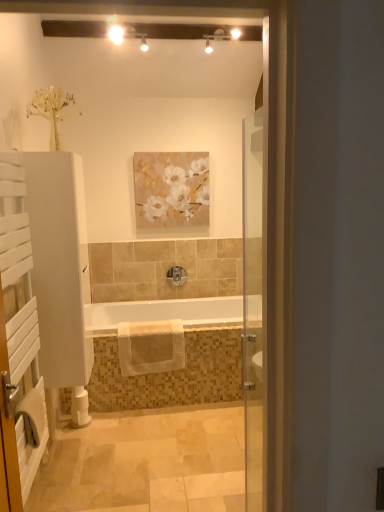
The image size is (384, 512). Describe the element at coordinates (163, 312) in the screenshot. I see `white glossy bathtub at center` at that location.

Find the location of a particular element. The width and height of the screenshot is (384, 512). polished chrome faucet at center is located at coordinates (176, 276).

Find the location of `white soft towel at lower left, arranged as the 2th bath towel when viewed from the right`. white soft towel at lower left, arranged as the 2th bath towel when viewed from the right is located at coordinates (32, 415).

At what (x,y) coordinates should I click in order to perform the action: click on white glossy bathtub at center. Please return your answer as a coordinate pair (x, y). Looking at the image, I should click on (163, 312).

In terms of size, does beige textured towel at center, which ranks as the 1th bath towel in right-to-left order, appear bigger or smaller than matte floral painting at upper center?

In the image, beige textured towel at center, which ranks as the 1th bath towel in right-to-left order, appears to be larger than matte floral painting at upper center.

Is beige textured towel at center, the 2th bath towel from the left, looking in the opposite direction of matte floral painting at upper center?

No, beige textured towel at center, the 2th bath towel from the left, is not facing away from matte floral painting at upper center.

From the image's perspective, relative to matte floral painting at upper center, is beige textured towel at center, the 2th bath towel from the left, above or below?

From the image's perspective, beige textured towel at center, the 2th bath towel from the left, appears below matte floral painting at upper center.

From the picture: Can you confirm if beige textured towel at center, which ranks as the 1th bath towel in right-to-left order, is thinner than matte floral painting at upper center?

In fact, beige textured towel at center, which ranks as the 1th bath towel in right-to-left order, might be wider than matte floral painting at upper center.

Does white soft towel at lower left, the 2th bath towel from the back, appear on the right side of beige textured towel at center, which is the 2th bath towel in front-to-back order?

In fact, white soft towel at lower left, the 2th bath towel from the back, is to the left of beige textured towel at center, which is the 2th bath towel in front-to-back order.

Would you consider white soft towel at lower left, which is the first bath towel from left to right, to be distant from beige textured towel at center, which ranks as the 1th bath towel in right-to-left order?

Yes.

Which object is thinner, white soft towel at lower left, the first bath towel viewed from the front, or beige textured towel at center, which ranks as the 1th bath towel in right-to-left order?

white soft towel at lower left, the first bath towel viewed from the front, is thinner.

Would you say matte floral painting at upper center is inside or outside white soft towel at lower left, which is the first bath towel from left to right?

matte floral painting at upper center exists outside the volume of white soft towel at lower left, which is the first bath towel from left to right.

Measure the distance between matte floral painting at upper center and white soft towel at lower left, the 2th bath towel from the back.

matte floral painting at upper center is 7.39 feet away from white soft towel at lower left, the 2th bath towel from the back.

Is matte floral painting at upper center at the right side of white soft towel at lower left, which is the first bath towel from left to right?

Indeed, matte floral painting at upper center is positioned on the right side of white soft towel at lower left, which is the first bath towel from left to right.

Who is shorter, matte floral painting at upper center or white soft towel at lower left, the first bath towel viewed from the front?

With less height is white soft towel at lower left, the first bath towel viewed from the front.

Is white glossy bathtub at center not near polished chrome faucet at center?

No, there isn't a large distance between white glossy bathtub at center and polished chrome faucet at center.

Considering the positions of objects white glossy bathtub at center and polished chrome faucet at center in the image provided, who is more to the left, white glossy bathtub at center or polished chrome faucet at center?

white glossy bathtub at center is more to the left.

Is white glossy bathtub at center positioned in front of polished chrome faucet at center?

Yes, it is.

From the image's perspective, which is above, white glossy bathtub at center or polished chrome faucet at center?

polished chrome faucet at center is shown above in the image.

Which is closer to the camera, (121,353) or (31,403)?

Point (121,353) is positioned farther from the camera compared to point (31,403).

Which of these two, beige textured towel at center, the 2th bath towel from the left, or white soft towel at lower left, which is the first bath towel from left to right, stands shorter?

With less height is white soft towel at lower left, which is the first bath towel from left to right.

Consider the image. Considering the positions of objects beige textured towel at center, which ranks as the 1th bath towel in right-to-left order, and white soft towel at lower left, the 2th bath towel from the back, in the image provided, who is more to the left, beige textured towel at center, which ranks as the 1th bath towel in right-to-left order, or white soft towel at lower left, the 2th bath towel from the back,?

white soft towel at lower left, the 2th bath towel from the back.

Is white wooden towel rack at left outside of beige textured towel at center, which is the 2th bath towel in front-to-back order?

Yes, white wooden towel rack at left is not within beige textured towel at center, which is the 2th bath towel in front-to-back order.

Is white wooden towel rack at left positioned with its back to beige textured towel at center, the 2th bath towel from the left?

That's not correct — white wooden towel rack at left is not looking away from beige textured towel at center, the 2th bath towel from the left.

This screenshot has width=384, height=512. In order to click on screen door lying in front of the beige textured towel at center, the 2th bath towel from the left in this screenshot , I will do `click(18, 340)`.

Is white wooden towel rack at left next to beige textured towel at center, which is the 2th bath towel in front-to-back order, and touching it?

No, white wooden towel rack at left is not touching beige textured towel at center, which is the 2th bath towel in front-to-back order.

Is white soft towel at lower left, the first bath towel viewed from the front, looking in the opposite direction of matte floral painting at upper center?

white soft towel at lower left, the first bath towel viewed from the front, does not have its back to matte floral painting at upper center.

Choose the correct answer: Is white soft towel at lower left, the 2th bath towel from the back, inside matte floral painting at upper center or outside it?

white soft towel at lower left, the 2th bath towel from the back, cannot be found inside matte floral painting at upper center.

In terms of height, does white soft towel at lower left, the 2th bath towel from the back, look taller or shorter compared to matte floral painting at upper center?

Clearly, white soft towel at lower left, the 2th bath towel from the back, is shorter compared to matte floral painting at upper center.

Where is `picture frame lying behind the white soft towel at lower left, arranged as the 2th bath towel when viewed from the right`? This screenshot has height=512, width=384. picture frame lying behind the white soft towel at lower left, arranged as the 2th bath towel when viewed from the right is located at coordinates (171, 189).

Identify the location of the 1st bath towel below the matte floral painting at upper center (from the image's perspective). The width and height of the screenshot is (384, 512). (151, 347).

Image resolution: width=384 pixels, height=512 pixels. In order to click on bath towel on the left of beige textured towel at center, the 2th bath towel from the left in this screenshot , I will do `click(32, 415)`.

Considering their positions, is white wooden towel rack at left positioned closer to beige textured towel at center, which ranks as the 1th bath towel in right-to-left order, than white soft towel at lower left, arranged as the 2th bath towel when viewed from the right?

white soft towel at lower left, arranged as the 2th bath towel when viewed from the right, is closer to beige textured towel at center, which ranks as the 1th bath towel in right-to-left order.

Considering their positions, is polished chrome faucet at center positioned closer to white glossy bathtub at center than matte floral painting at upper center?

polished chrome faucet at center.

From the image, which object appears to be nearer to polished chrome faucet at center, beige textured towel at center, which ranks as the 1th bath towel in right-to-left order, or white soft towel at lower left, arranged as the 2th bath towel when viewed from the right?

beige textured towel at center, which ranks as the 1th bath towel in right-to-left order.

When comparing their distances from white wooden towel rack at left, does polished chrome faucet at center or matte floral painting at upper center seem closer?

Among the two, matte floral painting at upper center is located nearer to white wooden towel rack at left.

Based on their spatial positions, is matte floral painting at upper center or polished chrome faucet at center further from beige textured towel at center, which ranks as the 1th bath towel in right-to-left order?

matte floral painting at upper center lies further to beige textured towel at center, which ranks as the 1th bath towel in right-to-left order, than the other object.

Based on their spatial positions, is polished chrome faucet at center or white soft towel at lower left, the first bath towel viewed from the front, further from beige textured towel at center, which is counted as the 1th bath towel, starting from the back?

Among the two, white soft towel at lower left, the first bath towel viewed from the front, is located further to beige textured towel at center, which is counted as the 1th bath towel, starting from the back.

When comparing their distances from white soft towel at lower left, the first bath towel viewed from the front, does polished chrome faucet at center or white wooden towel rack at left seem closer?

white wooden towel rack at left.

Looking at the image, which one is located closer to polished chrome faucet at center, white soft towel at lower left, arranged as the 2th bath towel when viewed from the right, or white wooden towel rack at left?

white soft towel at lower left, arranged as the 2th bath towel when viewed from the right, is closer to polished chrome faucet at center.

This screenshot has height=512, width=384. Identify the location of bathtub between white soft towel at lower left, the 2th bath towel from the back, and matte floral painting at upper center, along the z-axis. (163, 312).

This screenshot has width=384, height=512. Find the location of `bath towel positioned between white wooden towel rack at left and beige textured towel at center, the 2th bath towel from the left, from near to far`. bath towel positioned between white wooden towel rack at left and beige textured towel at center, the 2th bath towel from the left, from near to far is located at coordinates (32, 415).

Identify the location of bathtub located between beige textured towel at center, which is the 2th bath towel in front-to-back order, and polished chrome faucet at center in the depth direction. This screenshot has width=384, height=512. (163, 312).

This screenshot has height=512, width=384. I want to click on bathtub located between white soft towel at lower left, the 2th bath towel from the back, and polished chrome faucet at center in the depth direction, so [x=163, y=312].